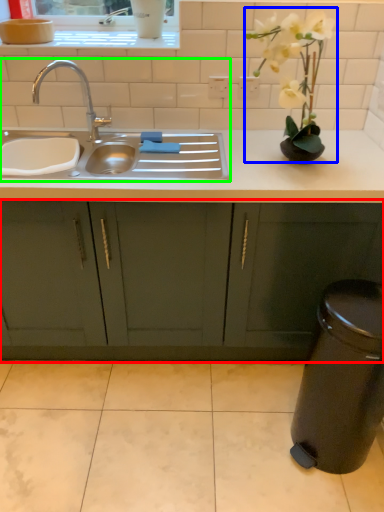
Question: Which is nearer to the cabinetry (highlighted by a red box)? floral arrangement (highlighted by a blue box) or sink (highlighted by a green box).

Choices:
 (A) floral arrangement
 (B) sink

Answer: (B)